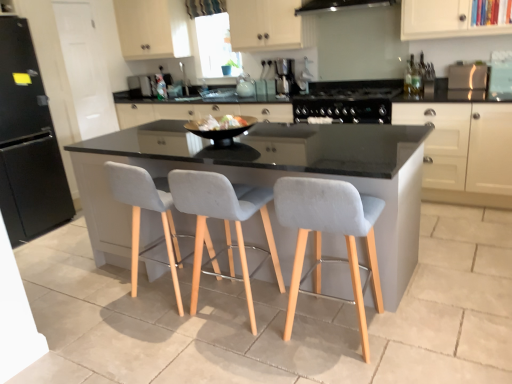
Locate an element on the screen. This screenshot has width=512, height=384. black glass range hood at upper center is located at coordinates (339, 5).

Locate an element on the screen. Image resolution: width=512 pixels, height=384 pixels. light gray fabric chair at center, which appears as the 1th chair when viewed from the left is located at coordinates (147, 209).

Locate an element on the screen. The image size is (512, 384). matte glass teapot at center, arranged as the second appliance when viewed from the right is located at coordinates (245, 86).

What do you see at coordinates (464, 151) in the screenshot? I see `white matte cabinet at upper right` at bounding box center [464, 151].

What do you see at coordinates (467, 76) in the screenshot?
I see `satin silver toaster at upper right, the 3th appliance positioned from the back` at bounding box center [467, 76].

Find the location of a particular element. This screenshot has height=384, width=512. satin silver coffee machine at upper center is located at coordinates (285, 77).

Identify the location of black glass range hood at upper center. The image size is (512, 384). (339, 5).

From a real-world perspective, is gray granite countertop at center beneath white matte cabinet at upper right?

Yes, from a real-world perspective, gray granite countertop at center is below white matte cabinet at upper right.

Between gray granite countertop at center and white matte cabinet at upper right, which one has larger width?

white matte cabinet at upper right is wider.

In terms of height, does gray granite countertop at center look taller or shorter compared to white matte cabinet at upper right?

Considering their sizes, gray granite countertop at center has less height than white matte cabinet at upper right.

Which is more to the right, satin silver coffee machine at upper center or satin silver toaster at upper right, the first appliance from the right?

From the viewer's perspective, satin silver toaster at upper right, the first appliance from the right, appears more on the right side.

You are a GUI agent. You are given a task and a screenshot of the screen. Output one action in this format:
    pyautogui.click(x=<x>, y=<y>)
    Task: Click on the coffee machine above the satin silver toaster at upper right, the 3th appliance positioned from the back (from a real-world perspective)
    
    Given the screenshot: What is the action you would take?
    pyautogui.click(x=285, y=77)

Based on the photo, is satin silver coffee machine at upper center with satin silver toaster at upper right, which is the fifth appliance in left-to-right order?

No.

Is satin silver coffee machine at upper center located outside satin silver toaster at upper right, the 3th appliance positioned from the back?

That's correct, satin silver coffee machine at upper center is outside of satin silver toaster at upper right, the 3th appliance positioned from the back.

Is black glass gas stove at center looking in the opposite direction of satin silver toaster at upper right, the third appliance in the front-to-back sequence?

No, satin silver toaster at upper right, the third appliance in the front-to-back sequence, is not at the back of black glass gas stove at center.

Which object is positioned more to the left, black glass gas stove at center or satin silver toaster at upper right, the third appliance in the front-to-back sequence?

Positioned to the left is black glass gas stove at center.

Considering the sizes of objects black glass gas stove at center and satin silver toaster at upper right, the 3th appliance positioned from the back, in the image provided, who is smaller, black glass gas stove at center or satin silver toaster at upper right, the 3th appliance positioned from the back,?

satin silver toaster at upper right, the 3th appliance positioned from the back, is smaller.

Considering the sizes of objects black glass gas stove at center and satin silver coffee machine at upper center in the image provided, who is wider, black glass gas stove at center or satin silver coffee machine at upper center?

black glass gas stove at center is wider.

Does point (352, 121) lie behind point (278, 68)?

That is False.

Which is behind, black glass gas stove at center or satin silver coffee machine at upper center?

satin silver coffee machine at upper center is behind.

From a real-world perspective, is black glass gas stove at center above or below satin silver coffee machine at upper center?

Clearly, from a real-world perspective, black glass gas stove at center is below satin silver coffee machine at upper center.

From the image's perspective, relative to metallic silver kettle at upper center, which is the first appliance in back-to-front order, is light gray fabric chair at center, which is counted as the first chair, starting from the right, above or below?

light gray fabric chair at center, which is counted as the first chair, starting from the right, is below metallic silver kettle at upper center, which is the first appliance in back-to-front order.

Is light gray fabric chair at center, which appears as the third chair when viewed from the left, oriented away from metallic silver kettle at upper center, positioned as the fourth appliance in right-to-left order?

light gray fabric chair at center, which appears as the third chair when viewed from the left, is not turned away from metallic silver kettle at upper center, positioned as the fourth appliance in right-to-left order.

Would you say light gray fabric chair at center, which appears as the third chair when viewed from the left, contains metallic silver kettle at upper center, the 5th appliance positioned from the front?

No, metallic silver kettle at upper center, the 5th appliance positioned from the front, is not inside light gray fabric chair at center, which appears as the third chair when viewed from the left.

From the picture: Are light gray fabric chair at center, the 2th chair in the left-to-right sequence, and white matte cabinet at upper right far apart?

Yes, light gray fabric chair at center, the 2th chair in the left-to-right sequence, and white matte cabinet at upper right are quite far apart.

Considering the relative positions of light gray fabric chair at center, the 2th chair in the left-to-right sequence, and white matte cabinet at upper right in the image provided, is light gray fabric chair at center, the 2th chair in the left-to-right sequence, to the right of white matte cabinet at upper right from the viewer's perspective?

No, light gray fabric chair at center, the 2th chair in the left-to-right sequence, is not to the right of white matte cabinet at upper right.

Would you say white matte cabinet at upper right is part of light gray fabric chair at center, which ranks as the second chair in right-to-left order,'s contents?

No, white matte cabinet at upper right is not a part of light gray fabric chair at center, which ranks as the second chair in right-to-left order.

Considering the positions of point (250, 288) and point (501, 145), is point (250, 288) closer or farther from the camera than point (501, 145)?

Point (250, 288).

From a real-world perspective, relative to black glass gas stove at center, is matte glass teapot at center, marked as the second appliance in a back-to-front arrangement, vertically above or below?

matte glass teapot at center, marked as the second appliance in a back-to-front arrangement, is above black glass gas stove at center.

From the image's perspective, between matte glass teapot at center, arranged as the fourth appliance when viewed from the left, and black glass gas stove at center, which one is located above?

matte glass teapot at center, arranged as the fourth appliance when viewed from the left, is shown above in the image.

Is matte glass teapot at center, marked as the second appliance in a back-to-front arrangement, taller or shorter than black glass gas stove at center?

In the image, matte glass teapot at center, marked as the second appliance in a back-to-front arrangement, appears to be taller than black glass gas stove at center.

Who is more distant, matte glass teapot at center, the fourth appliance in the front-to-back sequence, or black glass gas stove at center?

matte glass teapot at center, the fourth appliance in the front-to-back sequence, is further from the camera.

You are a GUI agent. You are given a task and a screenshot of the screen. Output one action in this format:
    pyautogui.click(x=<x>, y=<y>)
    Task: Click on the cabinetry that is above the gray granite countertop at center (from the image's perspective)
    
    Given the screenshot: What is the action you would take?
    464,151

At what (x,y) coordinates should I click in order to perform the action: click on the 1st appliance in front of the satin silver coffee machine at upper center, starting your count from the anchor. Please return your answer as a coordinate pair (x, y). Looking at the image, I should click on (467, 76).

When comparing their distances from gray granite countertop at center, does satin silver coffee machine at upper center or black glossy bowl at center, which appears as the third appliance when viewed from the right, seem closer?

The object closer to gray granite countertop at center is black glossy bowl at center, which appears as the third appliance when viewed from the right.

When comparing their distances from black glass range hood at upper center, does light gray fabric chair at center, which ranks as the second chair in right-to-left order, or transparent glass window at upper center seem closer?

The object closer to black glass range hood at upper center is transparent glass window at upper center.

When comparing their distances from metallic silver kettle at upper center, the 5th appliance positioned from the front, does satin silver toaster at upper right, the first appliance from the right, or black matte refrigerator at left, positioned as the first appliance in left-to-right order, seem further?

satin silver toaster at upper right, the first appliance from the right, lies further to metallic silver kettle at upper center, the 5th appliance positioned from the front, than the other object.

When comparing their distances from satin silver coffee machine at upper center, does light gray fabric chair at center, the 2th chair in the left-to-right sequence, or black glass gas stove at center seem further?

Based on the image, light gray fabric chair at center, the 2th chair in the left-to-right sequence, appears to be further to satin silver coffee machine at upper center.

From the image, which object appears to be nearer to black glossy bowl at center, which appears as the third appliance when viewed from the right, satin silver toaster at upper right, the first appliance from the right, or black glass gas stove at center?

black glass gas stove at center.

Based on their spatial positions, is satin silver coffee machine at upper center or black glass gas stove at center closer to light gray fabric chair at center, which appears as the third chair when viewed from the left?

black glass gas stove at center lies closer to light gray fabric chair at center, which appears as the third chair when viewed from the left, than the other object.

Considering their positions, is metallic silver kettle at upper center, the 5th appliance positioned from the front, positioned closer to white matte cabinet at upper right than light gray fabric chair at center, the 2th chair in the left-to-right sequence?

light gray fabric chair at center, the 2th chair in the left-to-right sequence, is closer to white matte cabinet at upper right.

Based on their spatial positions, is light gray fabric chair at center, which ranks as the second chair in right-to-left order, or light gray fabric chair at center, which is counted as the first chair, starting from the right, closer to light gray fabric chair at center, the 3th chair when ordered from right to left?

light gray fabric chair at center, which ranks as the second chair in right-to-left order, lies closer to light gray fabric chair at center, the 3th chair when ordered from right to left, than the other object.

This screenshot has height=384, width=512. In order to click on coffee machine between gray granite countertop at center and transparent glass window at upper center from front to back in this screenshot , I will do `click(285, 77)`.

Image resolution: width=512 pixels, height=384 pixels. I want to click on cabinetry between black glass range hood at upper center and light gray fabric chair at center, which appears as the third chair when viewed from the left, in the vertical direction, so (x=464, y=151).

What are the coordinates of `coffee machine located between light gray fabric chair at center, the 3th chair when ordered from right to left, and metallic silver kettle at upper center, positioned as the fourth appliance in right-to-left order, in the depth direction` in the screenshot? It's located at (285, 77).

Find the location of a particular element. The image size is (512, 384). home appliance between light gray fabric chair at center, which appears as the third chair when viewed from the left, and satin silver coffee machine at upper center in the front-back direction is located at coordinates (339, 5).